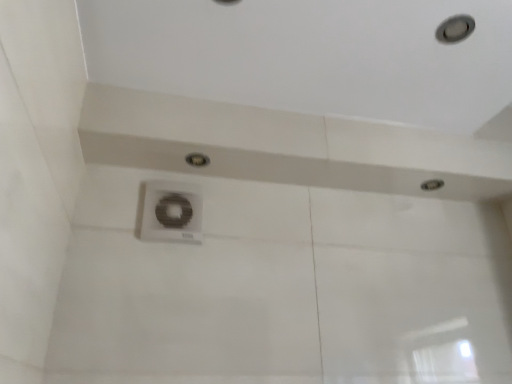
The height and width of the screenshot is (384, 512). Describe the element at coordinates (197, 160) in the screenshot. I see `matte silver droplight at center, marked as the 1th droplight in a left-to-right arrangement` at that location.

This screenshot has height=384, width=512. What do you see at coordinates (172, 212) in the screenshot?
I see `white plastic vent at center` at bounding box center [172, 212].

Identify the location of matte silver droplight at center, the 2th droplight in the right-to-left sequence. The width and height of the screenshot is (512, 384). (197, 160).

Identify the location of plumbing fixture on the left of matte silver droplight at upper right, which appears as the first droplight when viewed from the right. (172, 212).

From a real-world perspective, is white plastic vent at center physically located above or below matte silver droplight at upper right, which appears as the 2th droplight when viewed from the left?

Clearly, from a real-world perspective, white plastic vent at center is below matte silver droplight at upper right, which appears as the 2th droplight when viewed from the left.

Are white plastic vent at center and matte silver droplight at upper right, which appears as the 2th droplight when viewed from the left, making contact?

No, white plastic vent at center is not with matte silver droplight at upper right, which appears as the 2th droplight when viewed from the left.

Considering the positions of points (200, 156) and (434, 188), is point (200, 156) farther from camera compared to point (434, 188)?

No.

From the image's perspective, which one is positioned lower, matte silver droplight at center, arranged as the 2th droplight when viewed from the back, or matte silver droplight at upper right, arranged as the 2th droplight when viewed from the top?

From the image's view, matte silver droplight at upper right, arranged as the 2th droplight when viewed from the top, is below.

Is matte silver droplight at center, the first droplight when ordered from front to back, in front of or behind matte silver droplight at upper right, arranged as the 2th droplight when viewed from the top, in the image?

Visually, matte silver droplight at center, the first droplight when ordered from front to back, is located in front of matte silver droplight at upper right, arranged as the 2th droplight when viewed from the top.

Looking at this image, would you say matte silver droplight at upper right, which appears as the 2th droplight when viewed from the left, contains white plastic vent at center?

Actually, white plastic vent at center is outside matte silver droplight at upper right, which appears as the 2th droplight when viewed from the left.

The width and height of the screenshot is (512, 384). I want to click on the 2nd droplight behind the white plastic vent at center, counting from the anchor's position, so click(x=432, y=184).

From a real-world perspective, is matte silver droplight at upper right, which appears as the first droplight when viewed from the right, positioned under white plastic vent at center based on gravity?

Incorrect, from a real-world perspective, matte silver droplight at upper right, which appears as the first droplight when viewed from the right, is higher than white plastic vent at center.

Is the surface of matte silver droplight at upper right, which appears as the 2th droplight when viewed from the left, in direct contact with white plastic vent at center?

There is a gap between matte silver droplight at upper right, which appears as the 2th droplight when viewed from the left, and white plastic vent at center.

Is matte silver droplight at upper right, which is the 2th droplight from front to back, to the right of matte silver droplight at center, the 2th droplight in the right-to-left sequence, from the viewer's perspective?

Correct, you'll find matte silver droplight at upper right, which is the 2th droplight from front to back, to the right of matte silver droplight at center, the 2th droplight in the right-to-left sequence.

Consider the image. Does matte silver droplight at upper right, which is the 2th droplight from front to back, have a lesser height compared to matte silver droplight at center, arranged as the 2th droplight when viewed from the back?

Yes.

From a real-world perspective, is matte silver droplight at upper right, the first droplight in the back-to-front sequence, physically below matte silver droplight at center, marked as the 1th droplight in a left-to-right arrangement?

Answer: No, from a real-world perspective, matte silver droplight at upper right, the first droplight in the back-to-front sequence, is not below matte silver droplight at center, marked as the 1th droplight in a left-to-right arrangement.

Considering the points (198, 187) and (192, 164), which point is in front, point (198, 187) or point (192, 164)?

The point (198, 187) is closer to the camera.

From the image's perspective, does white plastic vent at center appear higher than matte silver droplight at center, the 1th droplight from the top?

No, from the image's perspective, white plastic vent at center is not above matte silver droplight at center, the 1th droplight from the top.

Considering their positions, is white plastic vent at center located in front of or behind matte silver droplight at center, the first droplight when ordered from front to back?

white plastic vent at center is in front of matte silver droplight at center, the first droplight when ordered from front to back.

Is matte silver droplight at center, the 2th droplight in the bottom-to-top sequence, a part of white plastic vent at center?

Definitely not — matte silver droplight at center, the 2th droplight in the bottom-to-top sequence, is not inside white plastic vent at center.

Where is `plumbing fixture lying below the matte silver droplight at center, marked as the 1th droplight in a left-to-right arrangement (from the image's perspective)`? The height and width of the screenshot is (384, 512). plumbing fixture lying below the matte silver droplight at center, marked as the 1th droplight in a left-to-right arrangement (from the image's perspective) is located at coordinates (172, 212).

From the image's perspective, is matte silver droplight at center, marked as the 1th droplight in a left-to-right arrangement, below white plastic vent at center?

No, from the image's perspective, matte silver droplight at center, marked as the 1th droplight in a left-to-right arrangement, is not below white plastic vent at center.

Is matte silver droplight at center, the 2th droplight in the bottom-to-top sequence, beside white plastic vent at center?

They are not placed beside each other.

Does point (194, 164) lie in front of point (147, 198)?

No, it is not.

Identify the location of plumbing fixture in front of the matte silver droplight at upper right, which appears as the first droplight when viewed from the right. The height and width of the screenshot is (384, 512). (172, 212).

Where is `droplight lying behind the matte silver droplight at center, marked as the 1th droplight in a left-to-right arrangement`? The height and width of the screenshot is (384, 512). droplight lying behind the matte silver droplight at center, marked as the 1th droplight in a left-to-right arrangement is located at coordinates (432, 184).

Looking at the image, which one is located closer to matte silver droplight at upper right, the first droplight in the back-to-front sequence, white plastic vent at center or matte silver droplight at center, the 1th droplight from the top?

matte silver droplight at center, the 1th droplight from the top.

From the image, which object appears to be farther from matte silver droplight at center, marked as the 1th droplight in a left-to-right arrangement, matte silver droplight at upper right, the first droplight in the back-to-front sequence, or white plastic vent at center?

Among the two, matte silver droplight at upper right, the first droplight in the back-to-front sequence, is located further to matte silver droplight at center, marked as the 1th droplight in a left-to-right arrangement.

When comparing their distances from white plastic vent at center, does matte silver droplight at upper right, arranged as the 2th droplight when viewed from the top, or matte silver droplight at center, the 2th droplight in the right-to-left sequence, seem closer?

matte silver droplight at center, the 2th droplight in the right-to-left sequence.

Looking at the image, which one is located further to white plastic vent at center, matte silver droplight at center, the 1th droplight from the top, or matte silver droplight at upper right, which appears as the first droplight when viewed from the right?

matte silver droplight at upper right, which appears as the first droplight when viewed from the right, lies further to white plastic vent at center than the other object.

When comparing their distances from matte silver droplight at center, the first droplight when ordered from front to back, does white plastic vent at center or matte silver droplight at upper right, which is the 2th droplight from front to back, seem closer?

white plastic vent at center.

From the image, which object appears to be nearer to matte silver droplight at upper right, which appears as the first droplight when viewed from the right, matte silver droplight at center, the 2th droplight in the bottom-to-top sequence, or white plastic vent at center?

matte silver droplight at center, the 2th droplight in the bottom-to-top sequence, lies closer to matte silver droplight at upper right, which appears as the first droplight when viewed from the right, than the other object.

Identify the location of droplight located between white plastic vent at center and matte silver droplight at upper right, arranged as the 2th droplight when viewed from the top, in the left-right direction. The width and height of the screenshot is (512, 384). (197, 160).